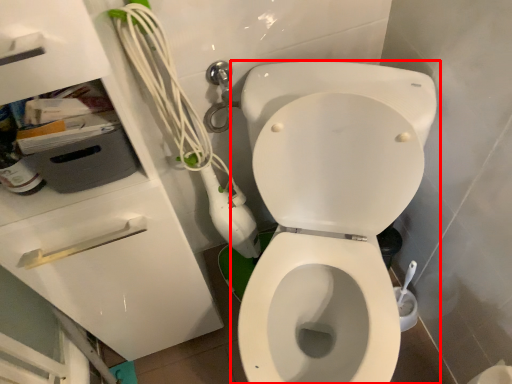
Question: From the image's perspective, where is toilet (annotated by the red box) located in relation to drawer in the image?

Choices:
 (A) above
 (B) below

Answer: (A)